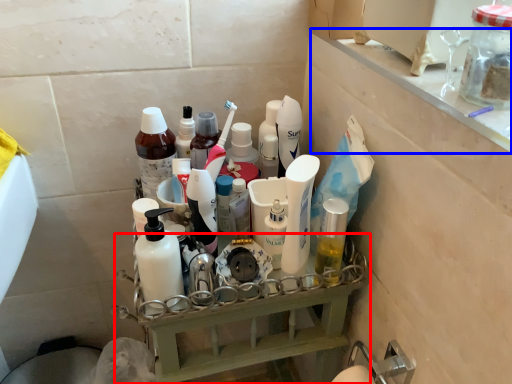
Question: Which point is closer to the camera, shelf (highlighted by a red box) or ledge (highlighted by a blue box)?

Choices:
 (A) shelf
 (B) ledge

Answer: (B)